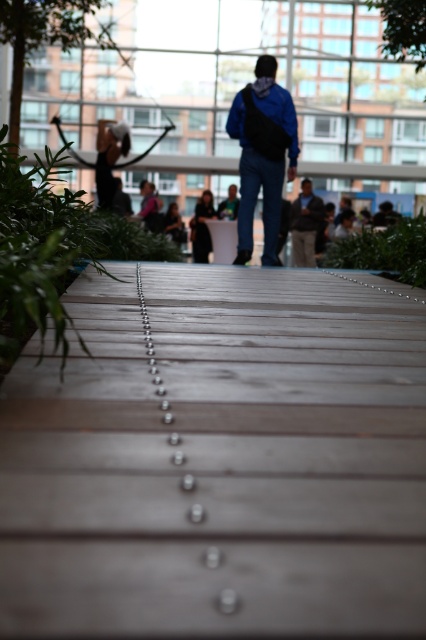
You are a drone operator trying to capture aerial footage of the wooden planks at center. Your drone has a maximum safe flying distance of 12 inches from the subject. Can your drone safely capture the footage from its current position without getting too close?

The distance between the wooden planks at center and the camera is 11.49 inches, which is within the drone operator s maximum safe flying distance of 12 inches. Therefore, the drone can safely capture the footage from its current position without getting too close.

You are standing on the wooden walkway and notice the wooden planks at center and the blue denim jeans at center. From your perspective, which object is positioned to the left?

The wooden planks at center is to the left of blue denim jeans at center, so the wooden planks at center is positioned to the left.

You are standing at the entrance of the walkway and want to reach the glass area ahead. Based on the wooden planks at center, which direction should you walk to stay on the walkway?

The wooden planks at center are located at point (218, 460), which is towards the center of the walkway. To stay on the walkway, you should walk straight ahead towards the glass area.